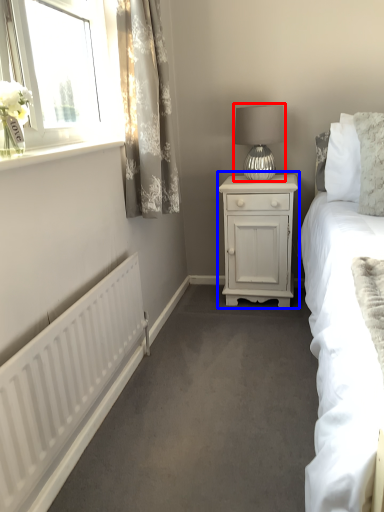
Question: Which object appears farthest to the camera in this image, table lamp (highlighted by a red box) or nightstand (highlighted by a blue box)?

Choices:
 (A) table lamp
 (B) nightstand

Answer: (B)